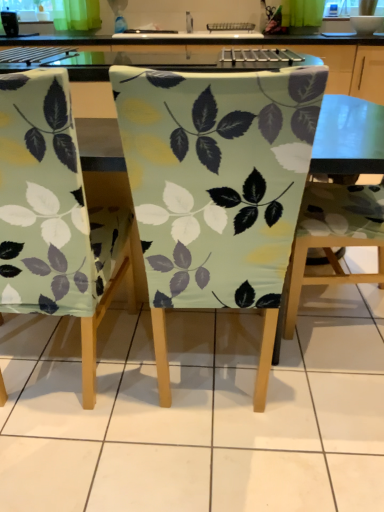
Where is `matte fabric chair at center, marked as the first chair in a right-to-left arrangement`? Image resolution: width=384 pixels, height=512 pixels. matte fabric chair at center, marked as the first chair in a right-to-left arrangement is located at coordinates (327, 244).

From the image's perspective, which one is positioned lower, matte fabric chair at center, marked as the first chair in a right-to-left arrangement, or matte fabric chair at center, which is the second chair from right to left?

matte fabric chair at center, which is the second chair from right to left.

Do you think matte fabric chair at center, marked as the first chair in a right-to-left arrangement, is within matte fabric chair at center, which is the second chair from right to left, or outside of it?

matte fabric chair at center, marked as the first chair in a right-to-left arrangement, is not enclosed by matte fabric chair at center, which is the second chair from right to left.

Are matte fabric chair at center, which is counted as the 3th chair, starting from the left, and matte fabric chair at center, the 2th chair when ordered from left to right, far apart?

No, there isn't a large distance between matte fabric chair at center, which is counted as the 3th chair, starting from the left, and matte fabric chair at center, the 2th chair when ordered from left to right.

Is matte fabric chair at center, marked as the first chair in a right-to-left arrangement, positioned far away from matte green fabric chair at center, the 3th chair from the right?

No, matte fabric chair at center, marked as the first chair in a right-to-left arrangement, is not far from matte green fabric chair at center, the 3th chair from the right.

Considering the positions of point (322, 129) and point (107, 291), is point (322, 129) closer or farther from the camera than point (107, 291)?

Point (322, 129).

Is matte fabric chair at center, which is counted as the 3th chair, starting from the left, completely or partially outside of matte green fabric chair at center, which ranks as the 1th chair in left-to-right order?

Yes, matte fabric chair at center, which is counted as the 3th chair, starting from the left, is outside of matte green fabric chair at center, which ranks as the 1th chair in left-to-right order.

Which is more to the left, matte fabric chair at center, which is the second chair from right to left, or matte fabric chair at center, which is counted as the 3th chair, starting from the left?

From the viewer's perspective, matte fabric chair at center, which is the second chair from right to left, appears more on the left side.

Does matte fabric chair at center, which is the second chair from right to left, have a smaller size compared to matte fabric chair at center, marked as the first chair in a right-to-left arrangement?

Correct, matte fabric chair at center, which is the second chair from right to left, occupies less space than matte fabric chair at center, marked as the first chair in a right-to-left arrangement.

Is matte fabric chair at center, the 2th chair when ordered from left to right, facing towards matte fabric chair at center, marked as the first chair in a right-to-left arrangement?

No.

Is the surface of matte fabric chair at center, which is the second chair from right to left, in direct contact with matte fabric chair at center, which is counted as the 3th chair, starting from the left?

No, matte fabric chair at center, which is the second chair from right to left, is not touching matte fabric chair at center, which is counted as the 3th chair, starting from the left.

In the scene shown: Considering the relative sizes of matte green fabric chair at center, the 3th chair from the right, and matte fabric chair at center, marked as the first chair in a right-to-left arrangement, in the image provided, is matte green fabric chair at center, the 3th chair from the right, wider than matte fabric chair at center, marked as the first chair in a right-to-left arrangement,?

No, matte green fabric chair at center, the 3th chair from the right, is not wider than matte fabric chair at center, marked as the first chair in a right-to-left arrangement.

Is point (83, 216) less distant than point (347, 142)?

That is True.

Relative to matte fabric chair at center, marked as the first chair in a right-to-left arrangement, is matte green fabric chair at center, which ranks as the 1th chair in left-to-right order, in front or behind?

Clearly, matte green fabric chair at center, which ranks as the 1th chair in left-to-right order, is in front of matte fabric chair at center, marked as the first chair in a right-to-left arrangement.

From a real-world perspective, is matte green fabric chair at center, which ranks as the 1th chair in left-to-right order, located higher than matte fabric chair at center, which is counted as the 3th chair, starting from the left?

Yes, from a real-world perspective, matte green fabric chair at center, which ranks as the 1th chair in left-to-right order, is over matte fabric chair at center, which is counted as the 3th chair, starting from the left

Considering the relative sizes of matte fabric chair at center, the 2th chair when ordered from left to right, and matte green fabric chair at center, which ranks as the 1th chair in left-to-right order, in the image provided, is matte fabric chair at center, the 2th chair when ordered from left to right, thinner than matte green fabric chair at center, which ranks as the 1th chair in left-to-right order,?

Yes, matte fabric chair at center, the 2th chair when ordered from left to right, is thinner than matte green fabric chair at center, which ranks as the 1th chair in left-to-right order.

Based on the photo, from the image's perspective, which object appears higher, matte fabric chair at center, which is the second chair from right to left, or matte green fabric chair at center, the 3th chair from the right?

matte fabric chair at center, which is the second chair from right to left, is shown above in the image.

Between matte fabric chair at center, which is the second chair from right to left, and matte green fabric chair at center, the 3th chair from the right, which one appears on the right side from the viewer's perspective?

matte fabric chair at center, which is the second chair from right to left, is more to the right.

How far apart are matte fabric chair at center, the 2th chair when ordered from left to right, and matte green fabric chair at center, the 3th chair from the right?

The distance of matte fabric chair at center, the 2th chair when ordered from left to right, from matte green fabric chair at center, the 3th chair from the right, is 29.06 centimeters.

Consider the image. Is matte green fabric chair at center, the 3th chair from the right, to the left of matte fabric chair at center, which is the second chair from right to left, from the viewer's perspective?

Correct, you'll find matte green fabric chair at center, the 3th chair from the right, to the left of matte fabric chair at center, which is the second chair from right to left.

From a real-world perspective, which chair is the 1st one underneath the matte fabric chair at center, the 2th chair when ordered from left to right? Please provide its 2D coordinates.

[(52, 215)]

From the image's perspective, is matte green fabric chair at center, the 3th chair from the right, beneath matte fabric chair at center, which is the second chair from right to left?

Indeed, from the image's perspective, matte green fabric chair at center, the 3th chair from the right, is shown beneath matte fabric chair at center, which is the second chair from right to left.

Between matte green fabric chair at center, which ranks as the 1th chair in left-to-right order, and matte fabric chair at center, which is the second chair from right to left, which one has larger width?

With larger width is matte green fabric chair at center, which ranks as the 1th chair in left-to-right order.

Find the location of a particular element. Image resolution: width=384 pixels, height=512 pixels. chair that appears above the matte fabric chair at center, which is the second chair from right to left (from the image's perspective) is located at coordinates (327, 244).

Locate an element on the screen. This screenshot has width=384, height=512. chair that is the 1st one above the matte fabric chair at center, which is counted as the 3th chair, starting from the left (from a real-world perspective) is located at coordinates (52, 215).

Considering their positions, is matte fabric chair at center, marked as the first chair in a right-to-left arrangement, positioned further to matte green fabric chair at center, which ranks as the 1th chair in left-to-right order, than matte fabric chair at center, which is the second chair from right to left?

Among the two, matte fabric chair at center, marked as the first chair in a right-to-left arrangement, is located further to matte green fabric chair at center, which ranks as the 1th chair in left-to-right order.

Estimate the real-world distances between objects in this image. Which object is further from matte green fabric chair at center, which ranks as the 1th chair in left-to-right order, matte fabric chair at center, the 2th chair when ordered from left to right, or matte fabric chair at center, marked as the first chair in a right-to-left arrangement?

matte fabric chair at center, marked as the first chair in a right-to-left arrangement, is positioned further to the anchor matte green fabric chair at center, which ranks as the 1th chair in left-to-right order.

Considering their positions, is matte fabric chair at center, marked as the first chair in a right-to-left arrangement, positioned closer to matte fabric chair at center, the 2th chair when ordered from left to right, than matte green fabric chair at center, the 3th chair from the right?

matte green fabric chair at center, the 3th chair from the right, lies closer to matte fabric chair at center, the 2th chair when ordered from left to right, than the other object.

Looking at this image, estimate the real-world distances between objects in this image. Which object is closer to matte fabric chair at center, marked as the first chair in a right-to-left arrangement, matte green fabric chair at center, which ranks as the 1th chair in left-to-right order, or matte fabric chair at center, the 2th chair when ordered from left to right?

Based on the image, matte fabric chair at center, the 2th chair when ordered from left to right, appears to be nearer to matte fabric chair at center, marked as the first chair in a right-to-left arrangement.

Based on their spatial positions, is matte green fabric chair at center, the 3th chair from the right, or matte fabric chair at center, marked as the first chair in a right-to-left arrangement, closer to matte fabric chair at center, the 2th chair when ordered from left to right?

The object closer to matte fabric chair at center, the 2th chair when ordered from left to right, is matte green fabric chair at center, the 3th chair from the right.

When comparing their distances from matte fabric chair at center, marked as the first chair in a right-to-left arrangement, does matte fabric chair at center, the 2th chair when ordered from left to right, or matte green fabric chair at center, the 3th chair from the right, seem further?

matte green fabric chair at center, the 3th chair from the right, is further to matte fabric chair at center, marked as the first chair in a right-to-left arrangement.

Identify the location of chair between matte green fabric chair at center, the 3th chair from the right, and matte fabric chair at center, which is counted as the 3th chair, starting from the left, in the horizontal direction. (216, 188).